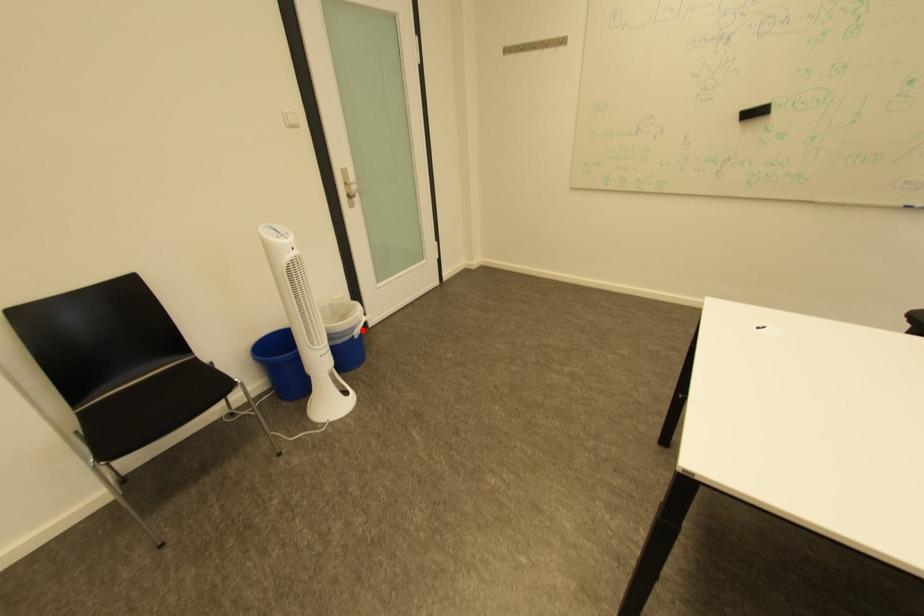
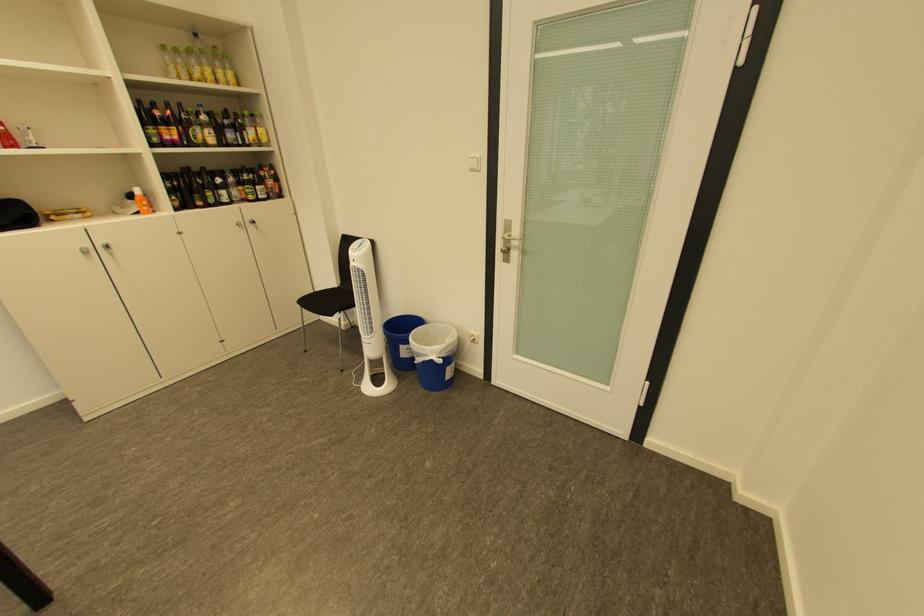
In the second image, find the point that corresponds to the highlighted location in the first image.

(429, 355)